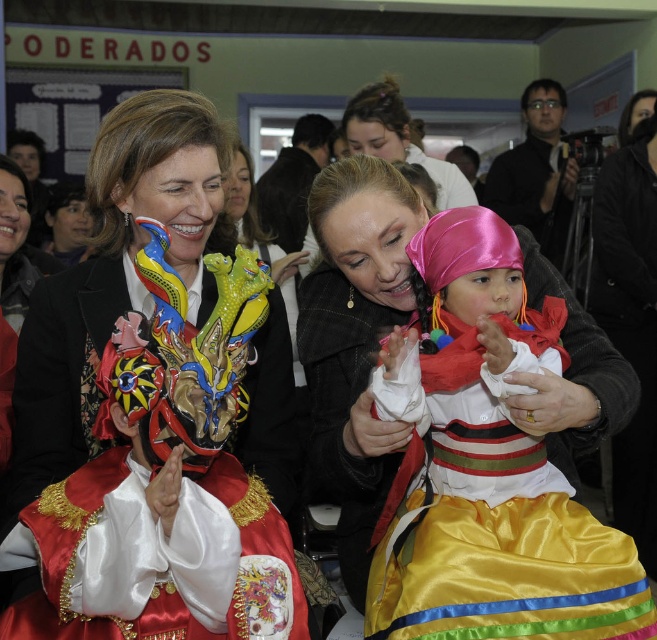
Between satin/embroidered dress at center and satin/yellow dress at center, which one appears on the left side from the viewer's perspective?

Positioned to the left is satin/embroidered dress at center.

Which is behind, point (168, 104) or point (509, 460)?

Positioned behind is point (168, 104).

The height and width of the screenshot is (640, 657). Identify the location of satin/embroidered dress at center. (152, 410).

Which is in front, point (537, 483) or point (545, 113)?

Positioned in front is point (537, 483).

Can you confirm if satin/yellow dress at center is positioned to the right of black glossy camera at upper right?

No, satin/yellow dress at center is not to the right of black glossy camera at upper right.

This screenshot has width=657, height=640. Describe the element at coordinates (486, 467) in the screenshot. I see `satin/yellow dress at center` at that location.

Find the location of `satin/yellow dress at center`. satin/yellow dress at center is located at coordinates (486, 467).

Does satin/embroidered dress at center appear on the right side of black glossy camera at upper right?

In fact, satin/embroidered dress at center is to the left of black glossy camera at upper right.

Can you confirm if satin/embroidered dress at center is positioned above black glossy camera at upper right?

No.

Who is more distant from viewer, (164, 99) or (510, 157)?

The point (510, 157) is more distant.

Identify the location of satin/embroidered dress at center. (152, 410).